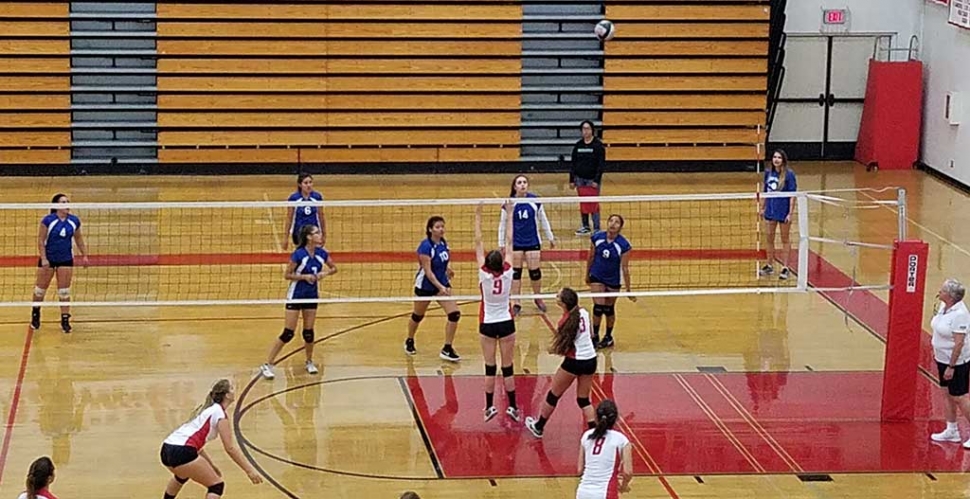
Where is `exit sign`? This screenshot has width=970, height=499. exit sign is located at coordinates (830, 15).